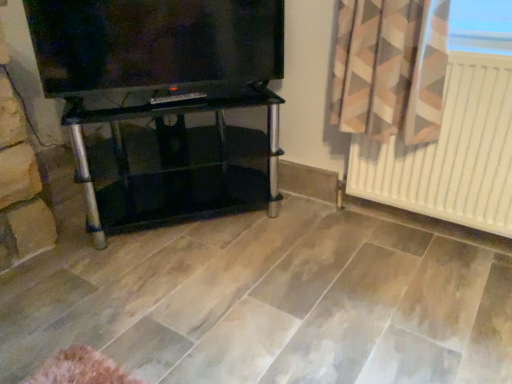
Question: Is black glass tv stand at center taller than white matte radiator at right?

Choices:
 (A) no
 (B) yes

Answer: (A)

Question: Is black glass tv stand at center next to white matte radiator at right?

Choices:
 (A) no
 (B) yes

Answer: (A)

Question: Is black glass tv stand at center located outside white matte radiator at right?

Choices:
 (A) no
 (B) yes

Answer: (B)

Question: From a real-world perspective, is black glass tv stand at center located higher than white matte radiator at right?

Choices:
 (A) yes
 (B) no

Answer: (B)

Question: Does black glass tv stand at center have a larger size compared to white matte radiator at right?

Choices:
 (A) no
 (B) yes

Answer: (B)

Question: Is matte black tv at upper left inside the boundaries of black glass tv stand at center, or outside?

Choices:
 (A) outside
 (B) inside

Answer: (A)

Question: Visually, is matte black tv at upper left positioned to the left or to the right of black glass tv stand at center?

Choices:
 (A) left
 (B) right

Answer: (A)

Question: Looking at the image, does matte black tv at upper left seem bigger or smaller compared to black glass tv stand at center?

Choices:
 (A) small
 (B) big

Answer: (A)

Question: From their relative heights in the image, would you say matte black tv at upper left is taller or shorter than black glass tv stand at center?

Choices:
 (A) short
 (B) tall

Answer: (A)

Question: Is black glass tv stand at center inside or outside of matte black tv at upper left?

Choices:
 (A) inside
 (B) outside

Answer: (B)

Question: From the image's perspective, relative to matte black tv at upper left, is black glass tv stand at center above or below?

Choices:
 (A) below
 (B) above

Answer: (A)

Question: In the image, is black glass tv stand at center positioned in front of or behind matte black tv at upper left?

Choices:
 (A) behind
 (B) front

Answer: (A)

Question: In terms of width, does black glass tv stand at center look wider or thinner when compared to matte black tv at upper left?

Choices:
 (A) wide
 (B) thin

Answer: (A)

Question: From a real-world perspective, relative to white matte radiator at right, is black glass tv stand at center vertically above or below?

Choices:
 (A) above
 (B) below

Answer: (B)

Question: Is black glass tv stand at center in front of or behind white matte radiator at right in the image?

Choices:
 (A) behind
 (B) front

Answer: (A)